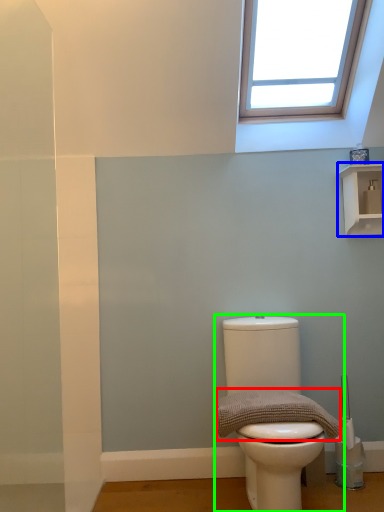
Question: Which object is positioned closest to material (highlighted by a red box)? Select from shelf (highlighted by a blue box) and toilet (highlighted by a green box).

Choices:
 (A) shelf
 (B) toilet

Answer: (B)